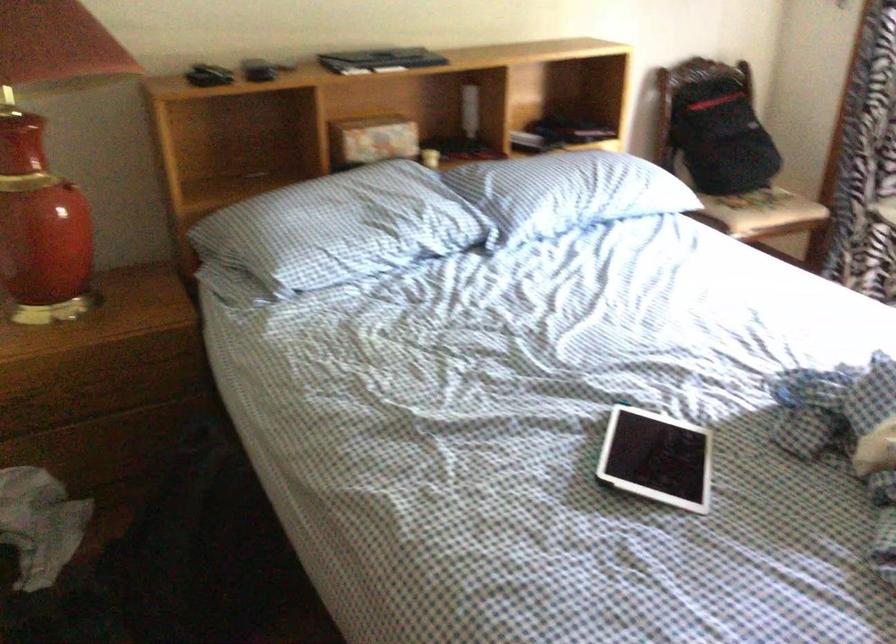
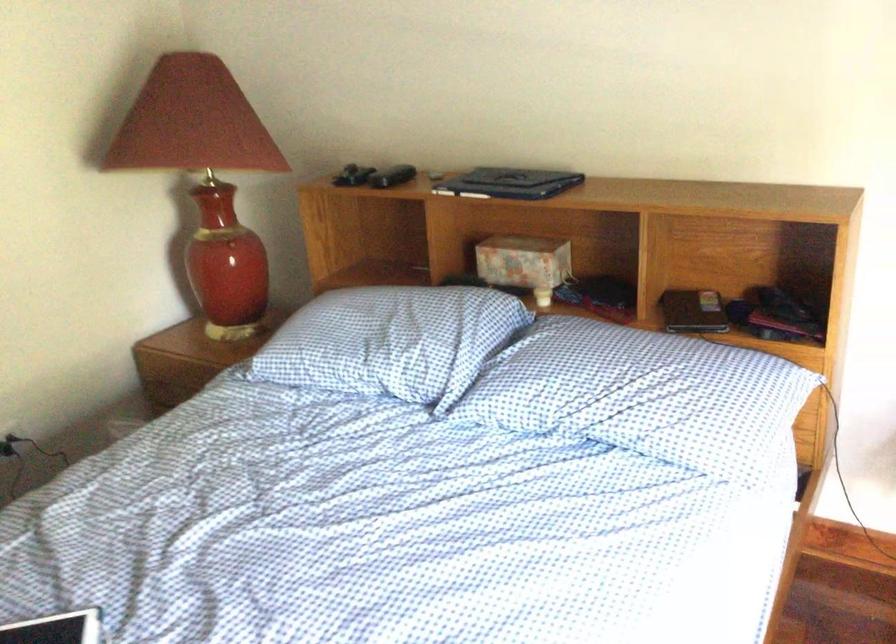
Locate, in the second image, the point that corresponds to [229,80] in the first image.

(352, 176)